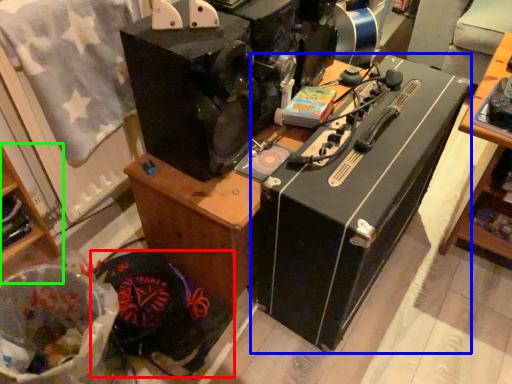
Question: Which is nearer to the waste (highlighted by a red box)? wide (highlighted by a blue box) or furniture (highlighted by a green box).

Choices:
 (A) wide
 (B) furniture

Answer: (B)